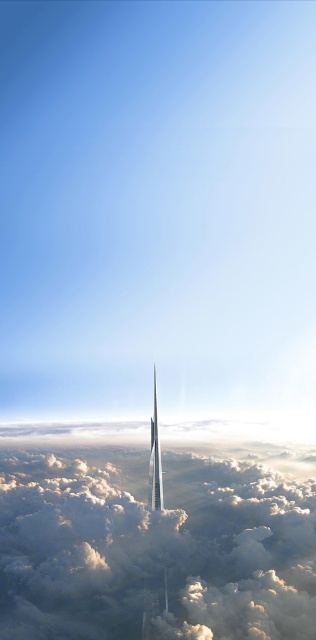
Question: Can you confirm if white fluffy cloud at center is bigger than shiny silver rocket at center?

Choices:
 (A) yes
 (B) no

Answer: (A)

Question: Can you confirm if white fluffy cloud at center is positioned below shiny silver rocket at center?

Choices:
 (A) no
 (B) yes

Answer: (B)

Question: Is white fluffy cloud at center smaller than shiny silver rocket at center?

Choices:
 (A) yes
 (B) no

Answer: (B)

Question: Which object is closer to the camera taking this photo?

Choices:
 (A) shiny silver rocket at center
 (B) white fluffy cloud at center

Answer: (A)

Question: Which of the following is the farthest from the observer?

Choices:
 (A) shiny silver rocket at center
 (B) white fluffy cloud at center

Answer: (B)